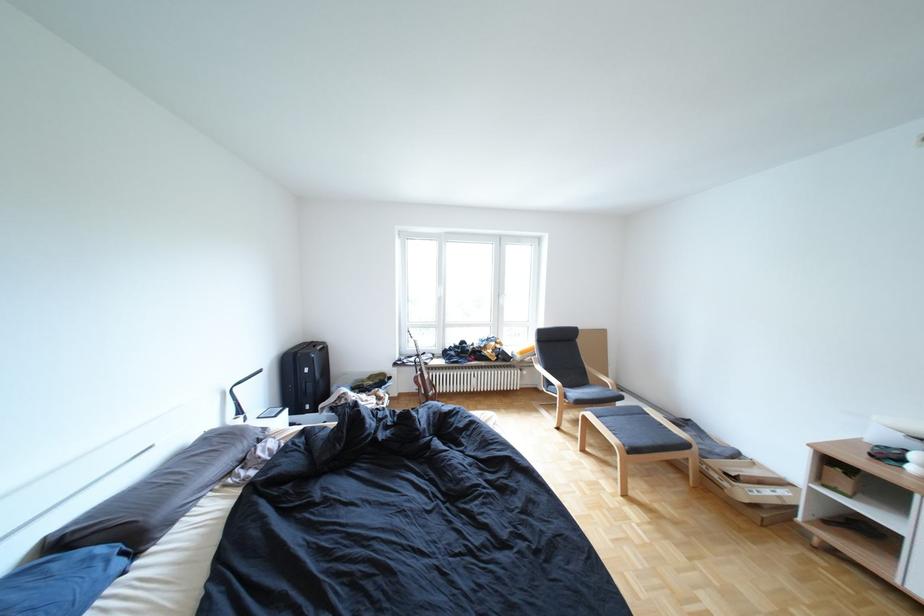
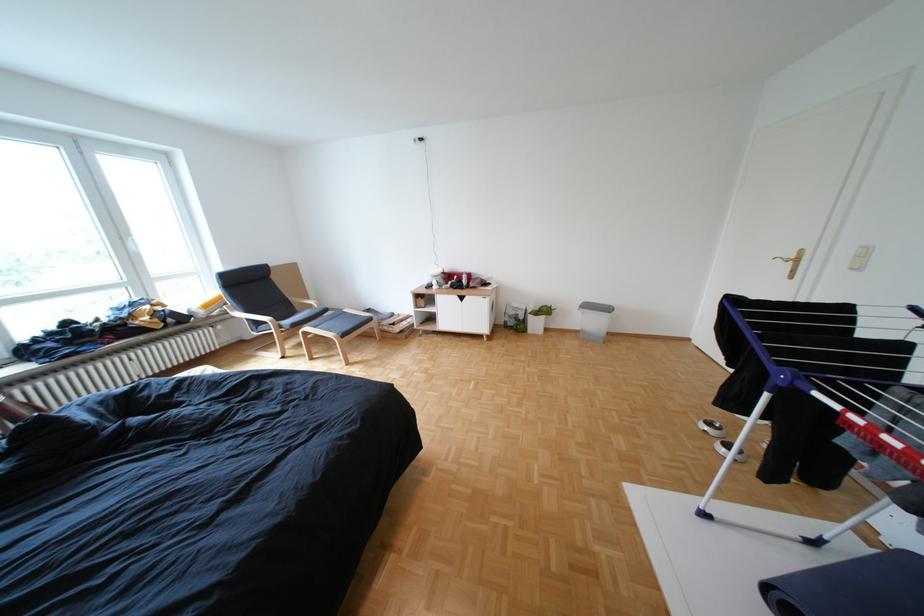
Question: I am providing you with two images of the same scene from different viewpoints. After the viewpoint changes to image2, which objects are now occluded?

Choices:
 (A) chair armrest
 (B) brass door handle
 (C) white window handle
 (D) none of these

Answer: (D)